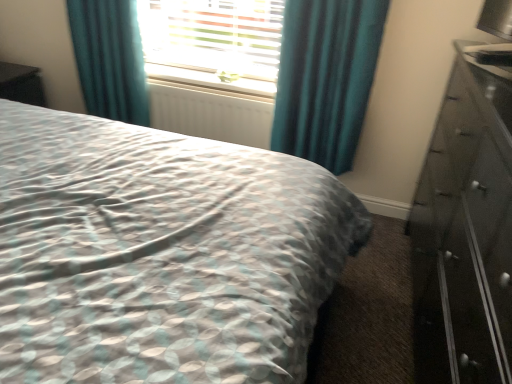
Question: Could teal fabric curtain at upper center, the 2th curtain in the left-to-right sequence, be considered to be inside black glossy chest of drawers at right?

Choices:
 (A) no
 (B) yes

Answer: (A)

Question: Considering the relative sizes of black glossy chest of drawers at right and teal fabric curtain at upper center, the first curtain from the right, in the image provided, is black glossy chest of drawers at right wider than teal fabric curtain at upper center, the first curtain from the right,?

Choices:
 (A) no
 (B) yes

Answer: (B)

Question: From a real-world perspective, is black glossy chest of drawers at right physically below teal fabric curtain at upper center, the first curtain from the right?

Choices:
 (A) no
 (B) yes

Answer: (B)

Question: Considering the relative positions of black glossy chest of drawers at right and teal fabric curtain at upper center, the 2th curtain in the left-to-right sequence, in the image provided, is black glossy chest of drawers at right to the right of teal fabric curtain at upper center, the 2th curtain in the left-to-right sequence, from the viewer's perspective?

Choices:
 (A) no
 (B) yes

Answer: (B)

Question: Does black glossy chest of drawers at right have a smaller size compared to teal fabric curtain at upper center, the 2th curtain in the left-to-right sequence?

Choices:
 (A) no
 (B) yes

Answer: (A)

Question: Is black glossy chest of drawers at right thinner than teal fabric curtain at upper center, the first curtain from the right?

Choices:
 (A) yes
 (B) no

Answer: (B)

Question: Is teal velvet curtain at upper left, the second curtain from the right, wider than black glossy chest of drawers at right?

Choices:
 (A) no
 (B) yes

Answer: (A)

Question: Does teal velvet curtain at upper left, the second curtain from the right, lie in front of black glossy chest of drawers at right?

Choices:
 (A) no
 (B) yes

Answer: (A)

Question: Considering the relative sizes of teal velvet curtain at upper left, the 1th curtain in the left-to-right sequence, and black glossy chest of drawers at right in the image provided, is teal velvet curtain at upper left, the 1th curtain in the left-to-right sequence, smaller than black glossy chest of drawers at right?

Choices:
 (A) no
 (B) yes

Answer: (B)

Question: From the image's perspective, is teal velvet curtain at upper left, the second curtain from the right, located above black glossy chest of drawers at right?

Choices:
 (A) yes
 (B) no

Answer: (A)

Question: From a real-world perspective, does teal velvet curtain at upper left, the second curtain from the right, sit lower than black glossy chest of drawers at right?

Choices:
 (A) yes
 (B) no

Answer: (B)

Question: Does teal velvet curtain at upper left, the second curtain from the right, have a lesser width compared to black glossy chest of drawers at right?

Choices:
 (A) no
 (B) yes

Answer: (B)

Question: From the image's perspective, is black glossy chest of drawers at right located above teal velvet curtain at upper left, the 1th curtain in the left-to-right sequence?

Choices:
 (A) no
 (B) yes

Answer: (A)